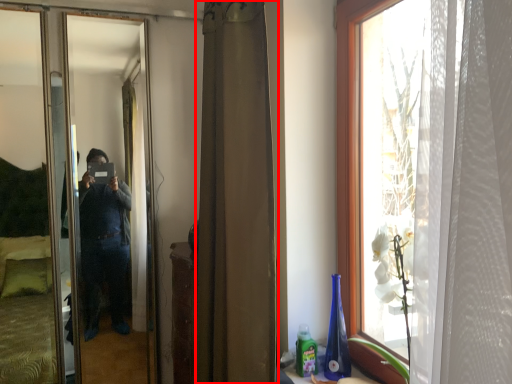
Question: From the image's perspective, where is curtain (annotated by the red box) located relative to mirror?

Choices:
 (A) above
 (B) below

Answer: (A)